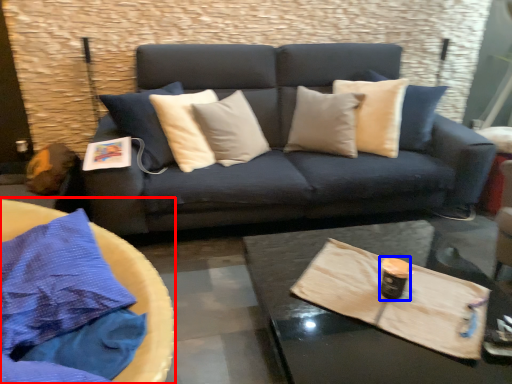
Question: Which of the following is the closest to the observer, round table (highlighted by a red box) or beverage (highlighted by a blue box)?

Choices:
 (A) round table
 (B) beverage

Answer: (A)